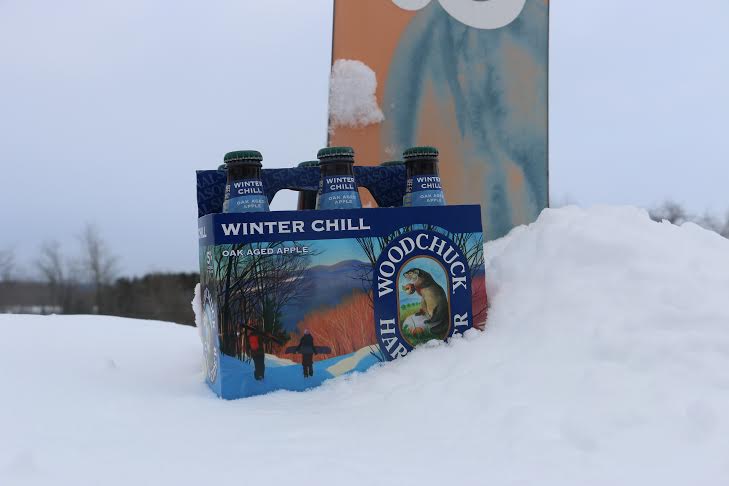
What are the coordinates of `poster` in the screenshot? It's located at (488, 97).